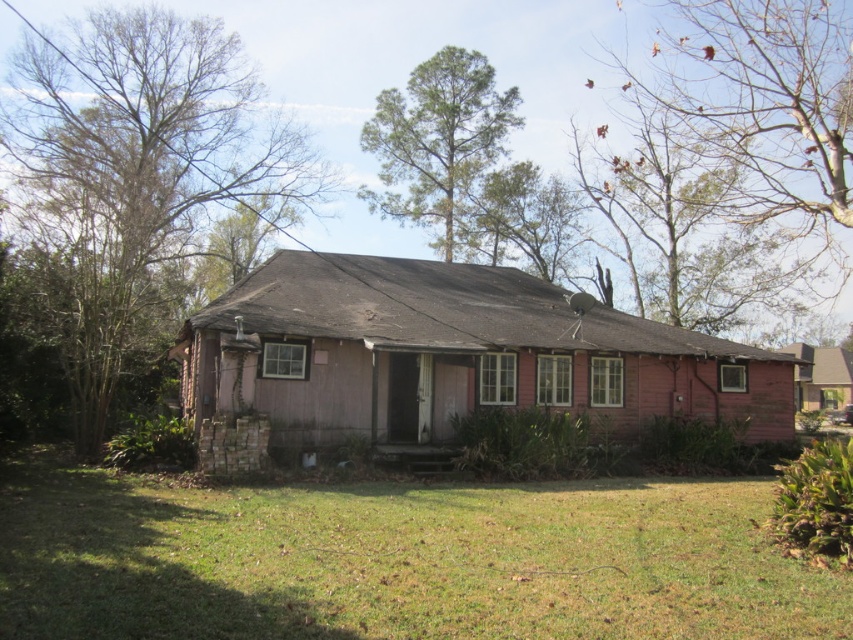
Question: Which of the following is the farthest from the observer?

Choices:
 (A) (843, 634)
 (B) (660, 253)

Answer: (B)

Question: Is green grass at lower center below green leafy tree at upper center?

Choices:
 (A) no
 (B) yes

Answer: (B)

Question: Which point is farther to the camera?

Choices:
 (A) (76, 353)
 (B) (683, 168)
 (C) (44, 616)
 (D) (413, 156)

Answer: (D)

Question: Estimate the real-world distances between objects in this image. Which object is farther from the green grass at lower center?

Choices:
 (A) brown leafy tree at upper right
 (B) bare branches at left
 (C) green leafy tree at upper center

Answer: (C)

Question: Is green grass at lower center smaller than green leafy tree at upper center?

Choices:
 (A) no
 (B) yes

Answer: (B)

Question: Is the position of green grass at lower center less distant than that of bare branches at left?

Choices:
 (A) yes
 (B) no

Answer: (A)